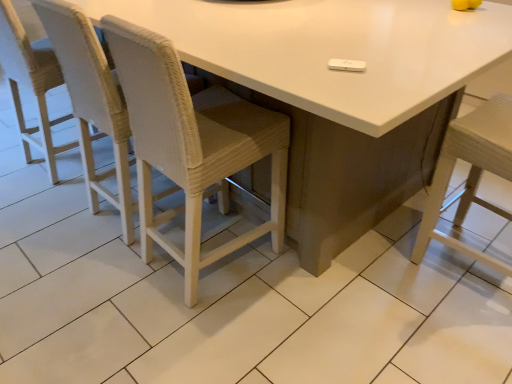
Question: Which direction should I rotate to look at woven white chair at center, the third chair in the left-to-right sequence, — up or down?

Choices:
 (A) up
 (B) down

Answer: (A)

Question: Can you confirm if woven fabric chair at left, the first chair in the left-to-right sequence, is bigger than white glossy table at center?

Choices:
 (A) no
 (B) yes

Answer: (A)

Question: Can you confirm if woven fabric chair at left, the first chair in the left-to-right sequence, is smaller than white glossy table at center?

Choices:
 (A) yes
 (B) no

Answer: (A)

Question: Can you confirm if woven fabric chair at left, the first chair in the left-to-right sequence, is taller than white glossy table at center?

Choices:
 (A) yes
 (B) no

Answer: (A)

Question: Considering the relative sizes of woven fabric chair at left, the 3th chair viewed from the right, and white glossy table at center in the image provided, is woven fabric chair at left, the 3th chair viewed from the right, shorter than white glossy table at center?

Choices:
 (A) no
 (B) yes

Answer: (A)

Question: Is woven fabric chair at left, the 3th chair viewed from the right, directly adjacent to white glossy table at center?

Choices:
 (A) yes
 (B) no

Answer: (B)

Question: Considering the relative sizes of woven fabric chair at left, the first chair in the left-to-right sequence, and white glossy table at center in the image provided, is woven fabric chair at left, the first chair in the left-to-right sequence, wider than white glossy table at center?

Choices:
 (A) yes
 (B) no

Answer: (B)

Question: Is white glossy table at center aimed at woven white chair at left, which ranks as the second chair in right-to-left order?

Choices:
 (A) yes
 (B) no

Answer: (A)

Question: From a real-world perspective, is white glossy table at center positioned under woven white chair at left, which ranks as the second chair in right-to-left order, based on gravity?

Choices:
 (A) yes
 (B) no

Answer: (A)

Question: Is white glossy table at center not close to woven white chair at left, which is the 2th chair from left to right?

Choices:
 (A) yes
 (B) no

Answer: (B)

Question: From the image's perspective, is white glossy table at center below woven white chair at left, which ranks as the second chair in right-to-left order?

Choices:
 (A) no
 (B) yes

Answer: (A)

Question: Is white glossy table at center at the left side of woven white chair at left, which ranks as the second chair in right-to-left order?

Choices:
 (A) yes
 (B) no

Answer: (B)

Question: Considering the relative sizes of white glossy table at center and woven white chair at left, which is the 2th chair from left to right, in the image provided, is white glossy table at center taller than woven white chair at left, which is the 2th chair from left to right,?

Choices:
 (A) no
 (B) yes

Answer: (A)

Question: Is woven fabric chair at left, the first chair in the left-to-right sequence, far from woven white chair at left, which is the 2th chair from left to right?

Choices:
 (A) yes
 (B) no

Answer: (B)